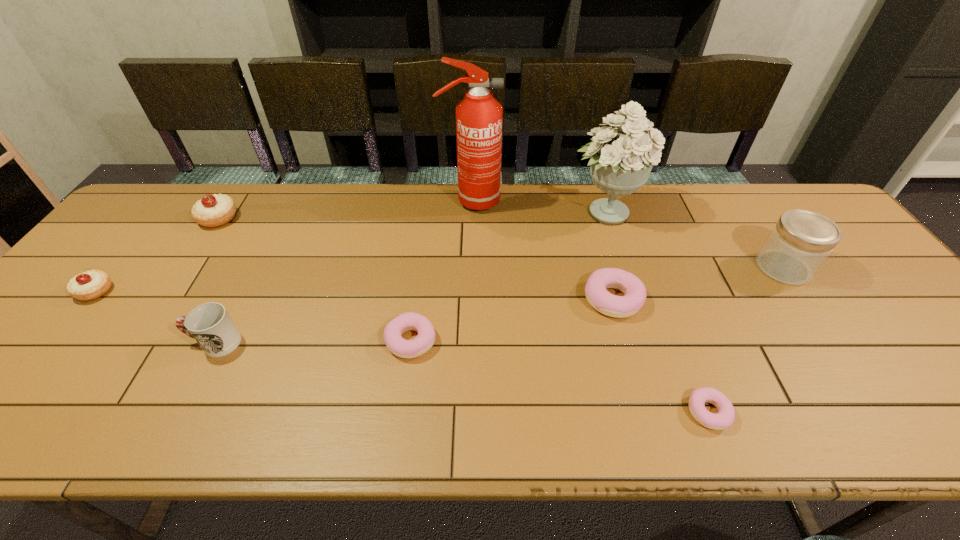
Identify the location of bouquet that is at the far edge. (620, 164).

Identify the location of pastry located at the far edge. (216, 210).

The image size is (960, 540). Identify the location of object present at the near edge. (724, 418).

Find the location of `object located in the left edge section of the desktop`. object located in the left edge section of the desktop is located at coordinates (90, 285).

In the image, there is a desktop. Identify the location of vacant region at the far edge. The image size is (960, 540). (412, 230).

Image resolution: width=960 pixels, height=540 pixels. In order to click on blank space at the near edge of the desktop in this screenshot , I will do click(201, 400).

Find the location of a particular element. The height and width of the screenshot is (540, 960). empty space between the green bouquet and the eighth object from right to left is located at coordinates (412, 215).

Identify the location of vacant space in between the smaller beige pastry and the eighth tallest object. This screenshot has width=960, height=540. [253, 316].

The image size is (960, 540). Identify the location of vacant space in between the cup and the second shortest pastry. (313, 341).

Locate an element on the screen. This screenshot has height=540, width=960. free space between the nearest pastry and the fire extinguisher is located at coordinates (589, 307).